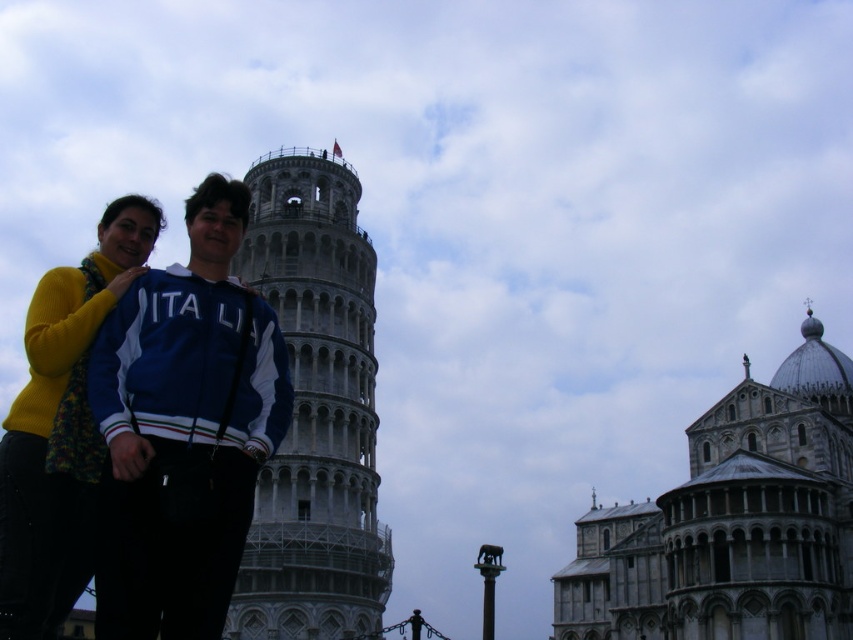
Between gray stone tower at center and blue fabric jacket at center, which one has less height?

blue fabric jacket at center is shorter.

Where is `gray stone tower at center`? The width and height of the screenshot is (853, 640). gray stone tower at center is located at coordinates click(x=732, y=522).

In order to click on gray stone tower at center in this screenshot , I will do `click(732, 522)`.

Can you confirm if white stone tower at center is positioned below blue fabric jacket at center?

Correct, white stone tower at center is located below blue fabric jacket at center.

Which is behind, point (310, 248) or point (73, 355)?

The point (310, 248) is more distant.

Which is in front, point (332, 477) or point (113, 228)?

Point (113, 228)

This screenshot has height=640, width=853. In order to click on white stone tower at center in this screenshot , I will do `click(314, 410)`.

Is gray stone tower at center to the left of white stone tower at center from the viewer's perspective?

In fact, gray stone tower at center is to the right of white stone tower at center.

Who is lower down, gray stone tower at center or white stone tower at center?

gray stone tower at center is lower down.

Where is `gray stone tower at center`? The height and width of the screenshot is (640, 853). gray stone tower at center is located at coordinates (732, 522).